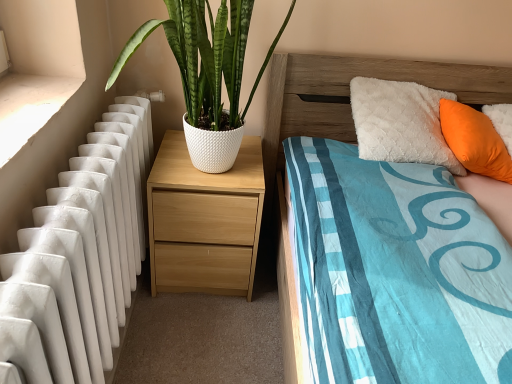
Question: Can you confirm if light wood/texture nightstand at center is bigger than orange fabric pillow at upper right?

Choices:
 (A) yes
 (B) no

Answer: (A)

Question: Is light wood/texture nightstand at center at the right side of orange fabric pillow at upper right?

Choices:
 (A) yes
 (B) no

Answer: (B)

Question: From the image's perspective, would you say light wood/texture nightstand at center is positioned over orange fabric pillow at upper right?

Choices:
 (A) yes
 (B) no

Answer: (B)

Question: Is orange fabric pillow at upper right surrounded by light wood/texture nightstand at center?

Choices:
 (A) no
 (B) yes

Answer: (A)

Question: From a real-world perspective, is light wood/texture nightstand at center positioned under orange fabric pillow at upper right based on gravity?

Choices:
 (A) yes
 (B) no

Answer: (A)

Question: Considering the positions of orange fabric pillow at upper right and white smooth concrete at left in the image, is orange fabric pillow at upper right bigger or smaller than white smooth concrete at left?

Choices:
 (A) big
 (B) small

Answer: (A)

Question: Considering the positions of orange fabric pillow at upper right and white smooth concrete at left in the image, is orange fabric pillow at upper right wider or thinner than white smooth concrete at left?

Choices:
 (A) thin
 (B) wide

Answer: (A)

Question: From a real-world perspective, is orange fabric pillow at upper right positioned above or below white smooth concrete at left?

Choices:
 (A) above
 (B) below

Answer: (B)

Question: Do you think orange fabric pillow at upper right is within white smooth concrete at left, or outside of it?

Choices:
 (A) outside
 (B) inside

Answer: (A)

Question: Is light wood/texture nightstand at center taller or shorter than orange fabric pillow at upper right?

Choices:
 (A) short
 (B) tall

Answer: (B)

Question: From a real-world perspective, is light wood/texture nightstand at center above or below orange fabric pillow at upper right?

Choices:
 (A) above
 (B) below

Answer: (B)

Question: In the image, is light wood/texture nightstand at center positioned in front of or behind orange fabric pillow at upper right?

Choices:
 (A) front
 (B) behind

Answer: (B)

Question: In terms of width, does light wood/texture nightstand at center look wider or thinner when compared to orange fabric pillow at upper right?

Choices:
 (A) thin
 (B) wide

Answer: (B)

Question: Considering the positions of point (506, 152) and point (417, 82), is point (506, 152) closer or farther from the camera than point (417, 82)?

Choices:
 (A) closer
 (B) farther

Answer: (A)

Question: From a real-world perspective, is orange fabric pillow at upper right physically located above or below wooden headboard at upper right?

Choices:
 (A) below
 (B) above

Answer: (A)